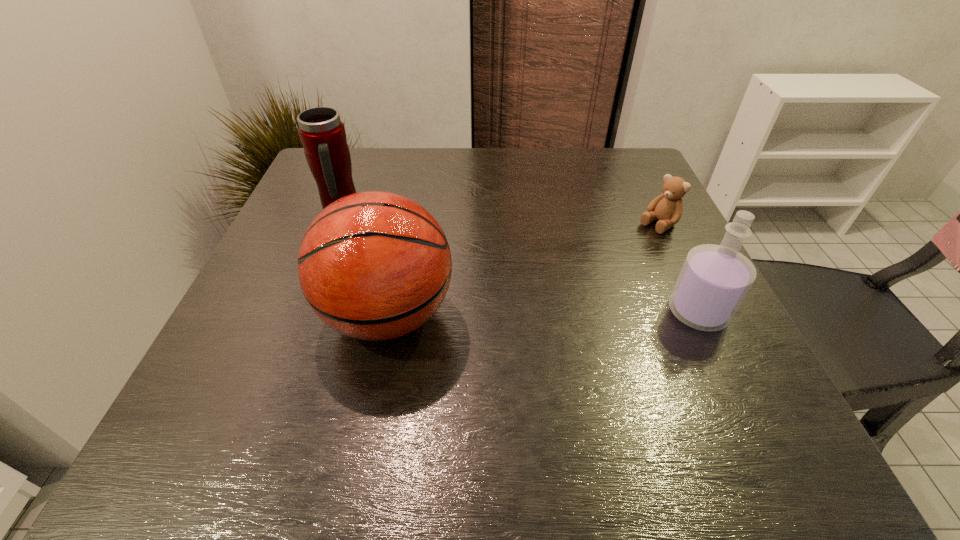
Where is `object situated at the far left corner`? object situated at the far left corner is located at coordinates (322, 133).

The width and height of the screenshot is (960, 540). Find the location of `object located in the near left corner section of the desktop`. object located in the near left corner section of the desktop is located at coordinates (374, 265).

Find the location of a particular element. This screenshot has width=960, height=540. vacant space at the far edge of the desktop is located at coordinates (567, 165).

Find the location of a particular element. This screenshot has height=540, width=960. vacant space at the near edge is located at coordinates (471, 389).

Find the location of a particular element. vacant space at the left edge of the desktop is located at coordinates (273, 308).

This screenshot has height=540, width=960. I want to click on free region at the right edge of the desktop, so click(x=622, y=211).

You are a GUI agent. You are given a task and a screenshot of the screen. Output one action in this format:
    pyautogui.click(x=<x>, y=<y>)
    Task: Click on the vacant space at the far left corner of the desktop
    The image size is (960, 540).
    Given the screenshot: What is the action you would take?
    pyautogui.click(x=375, y=156)

At what (x,y) coordinates should I click in order to perform the action: click on vacant space at the far right corner of the desktop. Please return your answer as a coordinate pair (x, y). Looking at the image, I should click on (589, 164).

What are the coordinates of `free area in between the basketball and the teddy bear` in the screenshot? It's located at (523, 270).

Identify the location of free space between the perfume and the thermos bottle. This screenshot has height=540, width=960. (x=518, y=260).